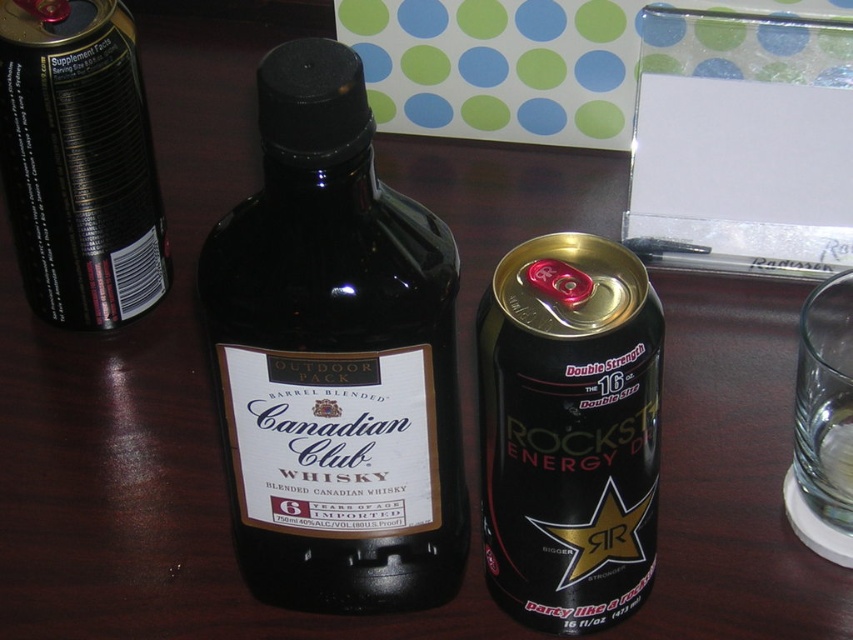
Question: Which is farther from the black glass bottle at center?

Choices:
 (A) black matte can at left
 (B) black metallic can at center

Answer: (A)

Question: Where is black glass bottle at center located in relation to black metallic can at center in the image?

Choices:
 (A) right
 (B) left

Answer: (B)

Question: Can you confirm if black glass bottle at center is positioned above black matte can at left?

Choices:
 (A) no
 (B) yes

Answer: (A)

Question: Among these objects, which one is farthest from the camera?

Choices:
 (A) black metallic can at center
 (B) black glass bottle at center

Answer: (A)

Question: Which point is farther to the camera?

Choices:
 (A) (556, 499)
 (B) (13, 172)

Answer: (B)

Question: Is black glass bottle at center positioned behind black matte can at left?

Choices:
 (A) no
 (B) yes

Answer: (A)